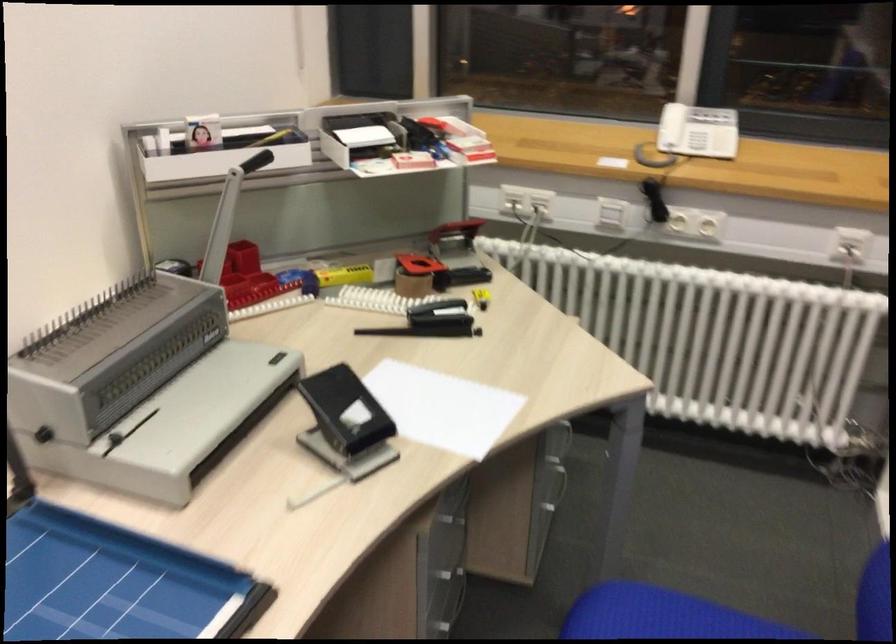
The location [414,272] corresponds to which object?

This point indicates the brown tape roll.